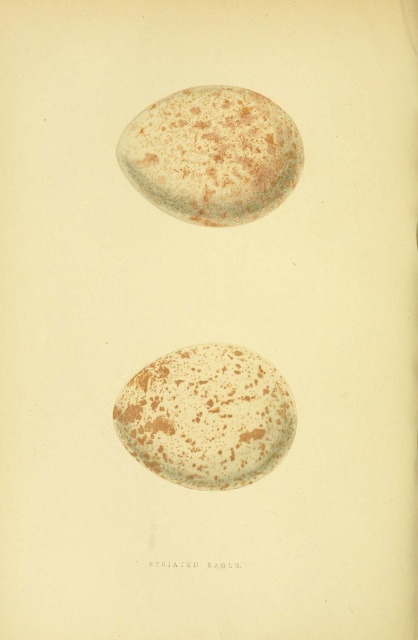
Question: Does speckled egg at bottom appear over speckled egg at upper center?

Choices:
 (A) no
 (B) yes

Answer: (A)

Question: Which point is farther from the camera taking this photo?

Choices:
 (A) (254, 416)
 (B) (129, 132)

Answer: (B)

Question: Is speckled egg at bottom to the right of speckled egg at upper center from the viewer's perspective?

Choices:
 (A) yes
 (B) no

Answer: (B)

Question: Considering the relative positions of speckled egg at bottom and speckled egg at upper center in the image provided, where is speckled egg at bottom located with respect to speckled egg at upper center?

Choices:
 (A) above
 (B) below

Answer: (B)